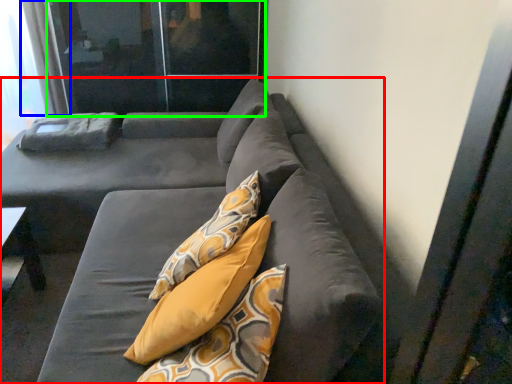
Question: Which is nearer to the studio couch (highlighted by a red box)? curtain (highlighted by a blue box) or screen door (highlighted by a green box).

Choices:
 (A) curtain
 (B) screen door

Answer: (B)